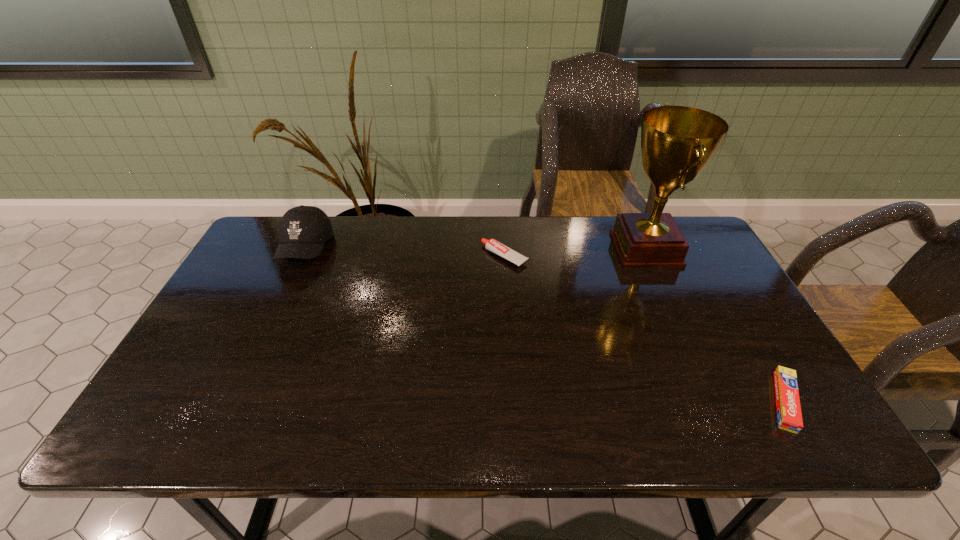
Locate an element on the screen. This screenshot has height=540, width=960. free region located 0.060m on the plaque of the tallest object is located at coordinates (594, 249).

Find the location of a particular element. The image size is (960, 540). vacant space located 0.240m on the front-facing side of the second tallest object is located at coordinates (264, 337).

This screenshot has width=960, height=540. I want to click on free location located on the front of the taller toothpaste, so click(x=511, y=350).

The image size is (960, 540). I want to click on vacant space located on the left of the nearest object, so [675, 402].

You are a GUI agent. You are given a task and a screenshot of the screen. Output one action in this format:
    pyautogui.click(x=<x>, y=<y>)
    Task: Click on the award situated at the far edge
    This screenshot has height=540, width=960.
    Given the screenshot: What is the action you would take?
    pyautogui.click(x=677, y=142)

Find the location of `baseball cap that is at the far edge`. baseball cap that is at the far edge is located at coordinates (303, 230).

This screenshot has width=960, height=540. In order to click on toothpaste situated at the far edge in this screenshot , I will do `click(492, 245)`.

This screenshot has width=960, height=540. What are the coordinates of `object at the near edge` in the screenshot? It's located at (789, 415).

Where is `object positioned at the left edge`? This screenshot has width=960, height=540. object positioned at the left edge is located at coordinates (303, 230).

Identify the location of award located at the right edge. The width and height of the screenshot is (960, 540). (677, 142).